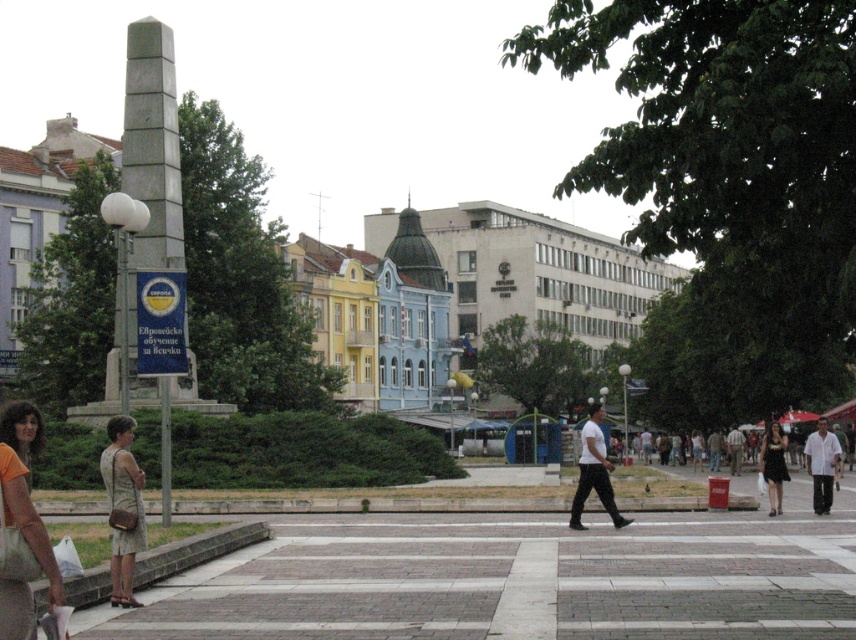
Is beige textured dress at lower left wider than black dress at lower right?

No, beige textured dress at lower left is not wider than black dress at lower right.

The image size is (856, 640). Describe the element at coordinates (123, 506) in the screenshot. I see `beige textured dress at lower left` at that location.

Where is `beige textured dress at lower left`? Image resolution: width=856 pixels, height=640 pixels. beige textured dress at lower left is located at coordinates (123, 506).

Looking at this image, how distant is white matte shirt at center from white cotton shirt at right?

white matte shirt at center is 6.63 meters from white cotton shirt at right.

Can you confirm if white matte shirt at center is smaller than white cotton shirt at right?

Yes.

Who is more distant from viewer, [611,513] or [811,474]?

The point [811,474] is more distant.

Find the location of a particular element. The height and width of the screenshot is (640, 856). white matte shirt at center is located at coordinates (593, 472).

Does orange cotton shirt at lower left appear on the left side of white matte shirt at center?

Yes, orange cotton shirt at lower left is to the left of white matte shirt at center.

The width and height of the screenshot is (856, 640). I want to click on orange cotton shirt at lower left, so click(25, 486).